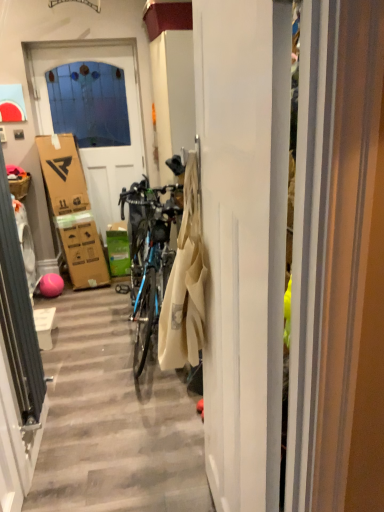
Question: From the image's perspective, is brown cardboard picnic basket at left positioned above or below white glossy washing machine at left?

Choices:
 (A) below
 (B) above

Answer: (B)

Question: Visually, is brown cardboard picnic basket at left positioned to the left or to the right of white glossy washing machine at left?

Choices:
 (A) left
 (B) right

Answer: (A)

Question: Estimate the real-world distances between objects in this image. Which object is farther from the white matte door at upper left, which ranks as the 2th door in front-to-back order?

Choices:
 (A) green cardboard box at center
 (B) white matte door at center, acting as the second door starting from the back
 (C) white glossy washing machine at left
 (D) brown cardboard picnic basket at left
 (E) beige cotton laundry at center

Answer: (B)

Question: Based on their relative distances, which object is farther from the white matte door at center, marked as the 1th door in a right-to-left arrangement?

Choices:
 (A) green cardboard box at center
 (B) white glossy washing machine at left
 (C) brown cardboard picnic basket at left
 (D) white matte door at upper left, which is the first door from left to right
 (E) beige cotton laundry at center

Answer: (D)